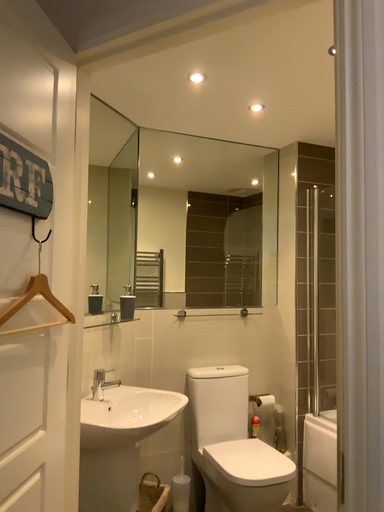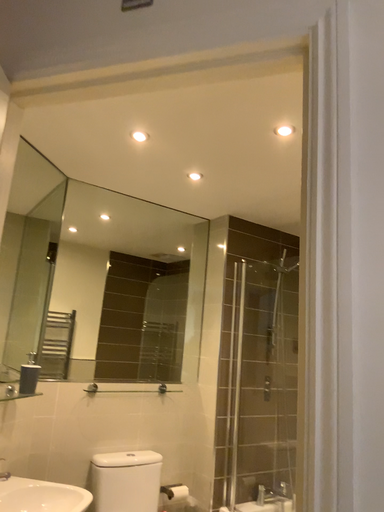
Question: How did the camera likely rotate when shooting the video?

Choices:
 (A) rotated right
 (B) rotated left

Answer: (A)